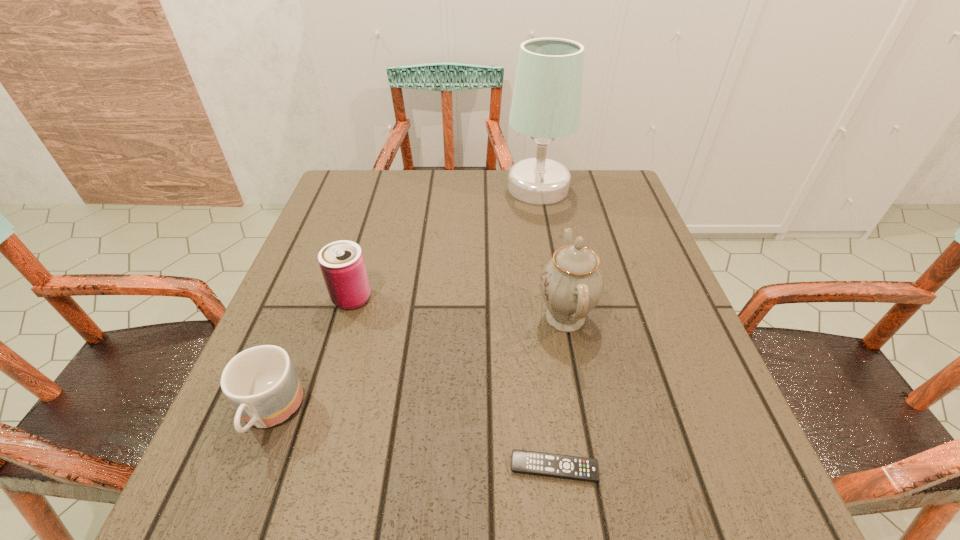
Identify the location of vacant space located on the spout of the chinaware. The image size is (960, 540). (336, 317).

This screenshot has height=540, width=960. Identify the location of free space located on the spout of the chinaware. (456, 317).

This screenshot has width=960, height=540. In order to click on free space located 0.060m on the left of the can in this screenshot , I will do `click(303, 298)`.

The height and width of the screenshot is (540, 960). In order to click on vacant space located on the side with the handle of the fourth tallest object in this screenshot , I will do `click(239, 496)`.

The width and height of the screenshot is (960, 540). In order to click on vacant space situated on the left of the shortest object in this screenshot , I will do [350, 468].

In order to click on object that is at the far edge in this screenshot , I will do `click(546, 105)`.

This screenshot has width=960, height=540. I want to click on object that is at the near edge, so click(538, 463).

Where is `can located in the left edge section of the desktop`? can located in the left edge section of the desktop is located at coordinates (342, 264).

This screenshot has height=540, width=960. In order to click on mug positioned at the left edge in this screenshot , I will do `click(260, 382)`.

I want to click on object present at the right edge, so click(x=546, y=105).